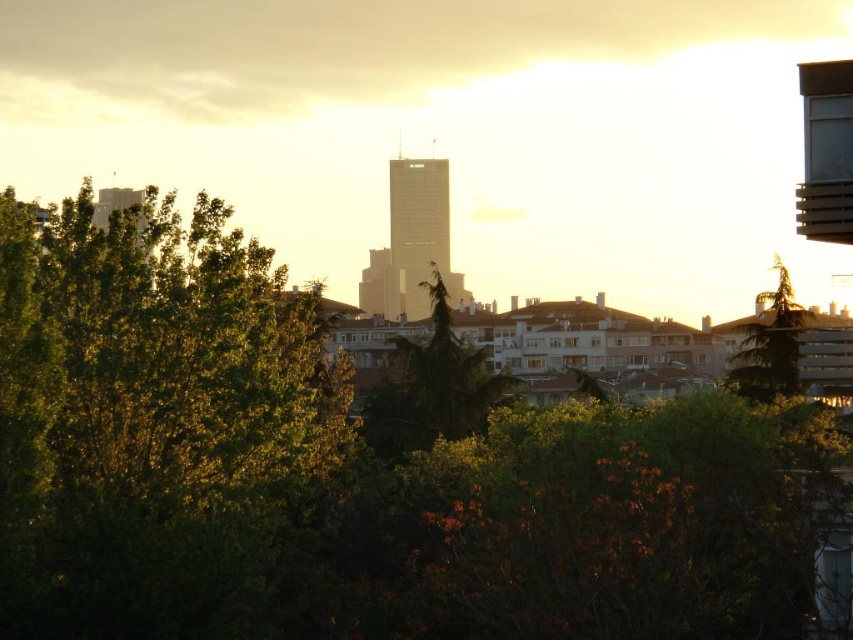
Which of these two, green leafy tree at center or green textured tree at right, stands taller?

green leafy tree at center is taller.

Can you confirm if green leafy tree at center is positioned above green textured tree at right?

Actually, green leafy tree at center is below green textured tree at right.

Is point (19, 508) closer to viewer compared to point (798, 372)?

Yes, it is.

Locate an element on the screen. This screenshot has height=640, width=853. green leafy tree at center is located at coordinates pos(347,472).

Can you confirm if green leafy tree at center is positioned to the left of green leafy tree at left?

Incorrect, green leafy tree at center is not on the left side of green leafy tree at left.

Can you confirm if green leafy tree at center is positioned below green leafy tree at left?

Yes.

Identify the location of green leafy tree at center. (347, 472).

Find the location of a particular element. The height and width of the screenshot is (640, 853). green leafy tree at center is located at coordinates (347, 472).

Does green leafy tree at center come in front of green textured tree at center?

Yes, green leafy tree at center is closer to the viewer.

Does green leafy tree at center have a larger size compared to green textured tree at center?

Yes.

Find the location of a particular element. green leafy tree at center is located at coordinates (347, 472).